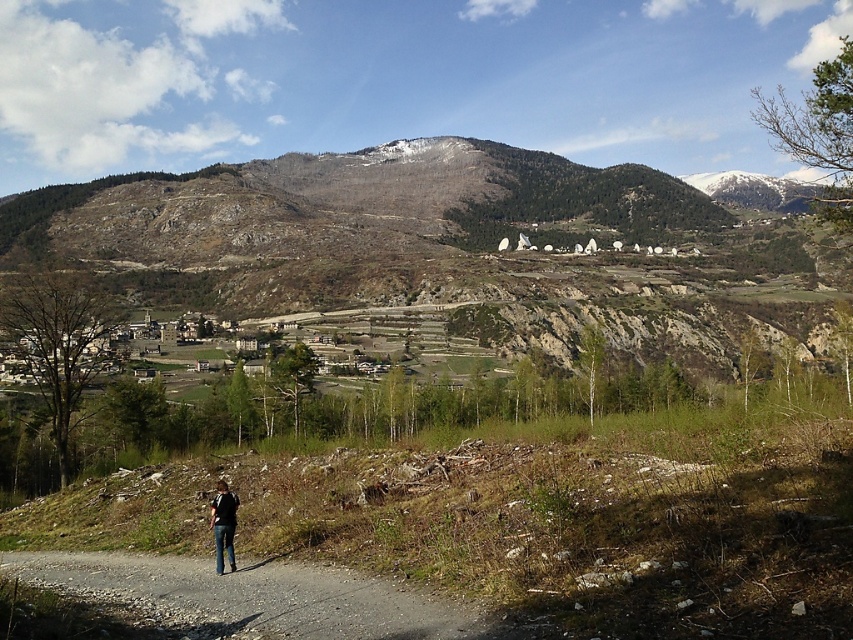
Measure the distance between gray gravel path at lower left and denim jacket at lower left.

gray gravel path at lower left is 5.97 meters from denim jacket at lower left.

Who is positioned more to the left, gray gravel path at lower left or denim jacket at lower left?

Positioned to the left is denim jacket at lower left.

Is point (413, 621) more distant than point (218, 500)?

No, it is not.

Image resolution: width=853 pixels, height=640 pixels. Find the location of `gray gravel path at lower left`. gray gravel path at lower left is located at coordinates (258, 595).